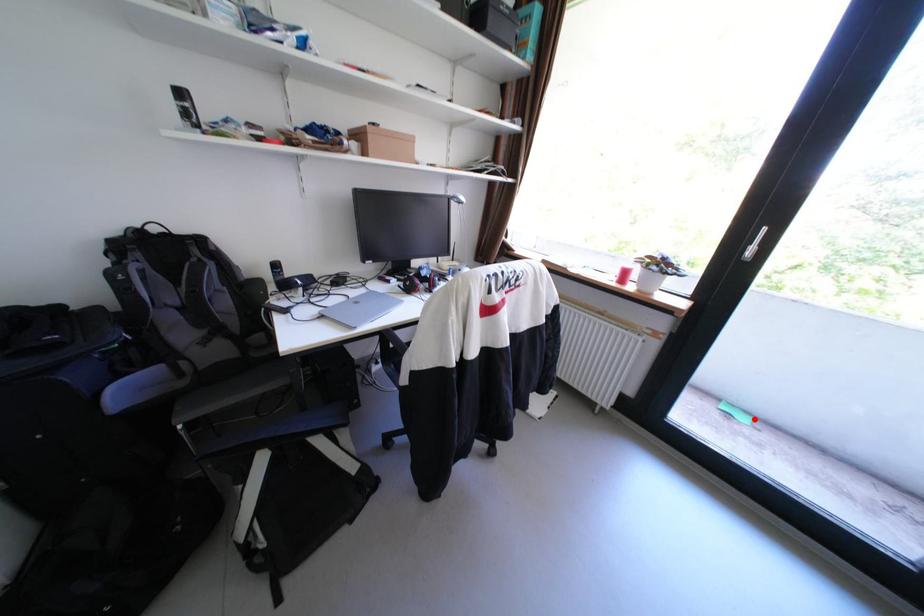
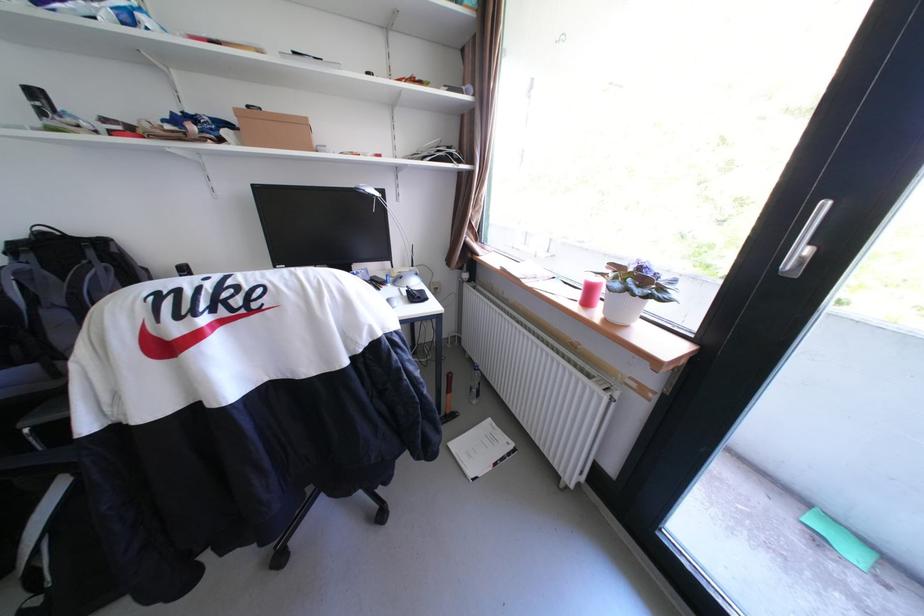
Question: A red point is marked in image1. In image2, is the corresponding 3D point closer to the camera or farther? Reply with the corresponding letter.

Choices:
 (A) The corresponding 3D point is closer.
 (B) The corresponding 3D point is farther.

Answer: (B)